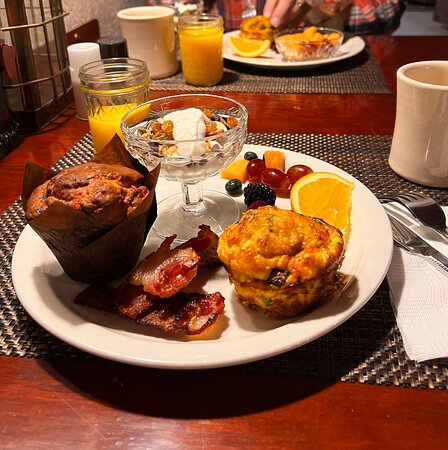
The width and height of the screenshot is (448, 450). I want to click on wood surface, so click(x=336, y=435).